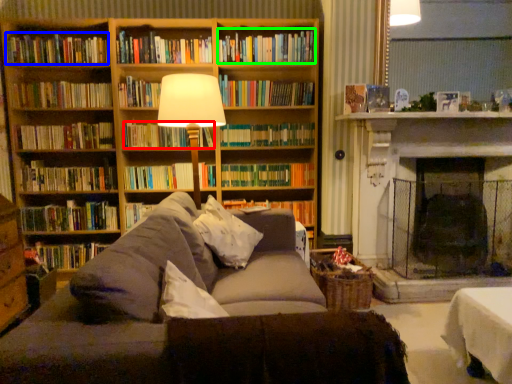
Question: Which is nearer to the book (highlighted by a red box)? book (highlighted by a blue box) or book (highlighted by a green box).

Choices:
 (A) book
 (B) book

Answer: (A)